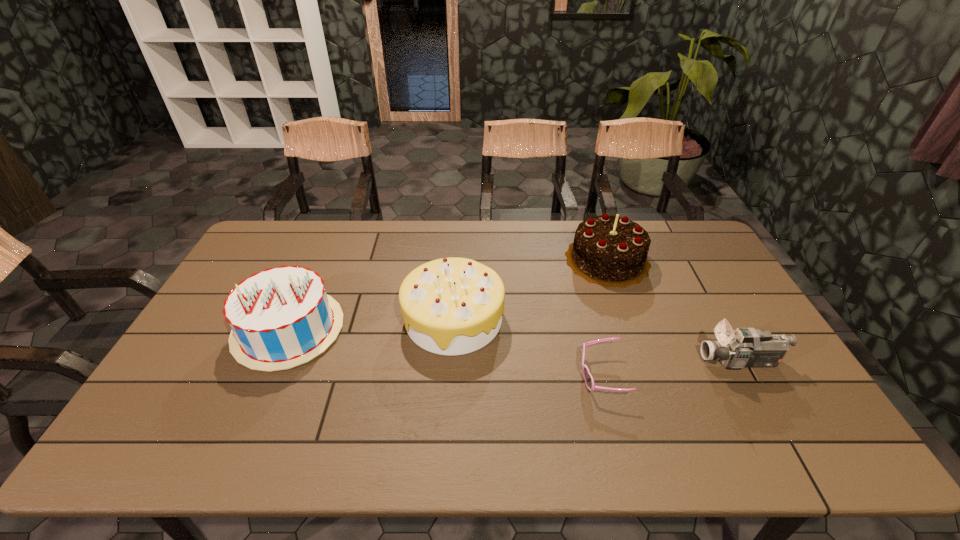
Identify the location of free space at the left edge. (221, 374).

You are a GUI agent. You are given a task and a screenshot of the screen. Output one action in this format:
    pyautogui.click(x=<x>, y=<y>)
    Task: Click on the free space at the right edge
    This screenshot has width=960, height=540.
    Given the screenshot: What is the action you would take?
    pyautogui.click(x=741, y=389)

Find the location of a particular element. The width and height of the screenshot is (960, 540). vacant area at the far right corner of the desktop is located at coordinates (666, 235).

Where is `vacant point located between the rightmost birthday cake and the fourth object from right to left`? vacant point located between the rightmost birthday cake and the fourth object from right to left is located at coordinates (530, 289).

I want to click on free spot between the second birthday cake from right to left and the rightmost object, so click(x=597, y=340).

I want to click on free space between the second birthday cake from right to left and the leftmost birthday cake, so click(372, 324).

Locate an element on the screen. free space between the rightmost birthday cake and the fourth tallest object is located at coordinates (674, 310).

Identify the location of vacant space in between the camcorder and the shortest object. (671, 368).

Identify the location of free point between the rightmost object and the shortest object. coord(671,368).

You are a GUI agent. You are given a task and a screenshot of the screen. Output one action in this format:
    pyautogui.click(x=<x>, y=<y>)
    Task: Click on the free area in between the shortest object and the rightmost birthday cake
    
    Given the screenshot: What is the action you would take?
    pyautogui.click(x=605, y=318)